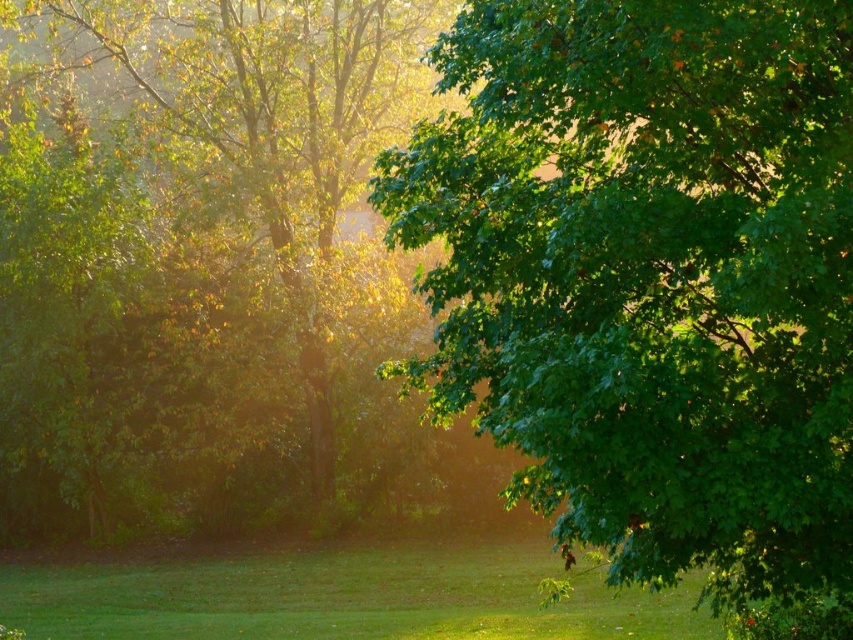
You are standing at the center of the lawn and want to take a photo of the green leafy tree at upper right. Considering your current position, is the tree positioned to your left or right side?

The green leafy tree at upper right is located at point 0.444 on the x axis, which is to the right side of the frame, so from your central position on the lawn, the tree would be to your right side.

You are standing in the middle of the lawn and want to take a photo of the green leafy tree at upper right and the green grass at lower center. Which object should you zoom in more on to capture its details clearly?

The green leafy tree at upper right is smaller in size compared to the green grass at lower center, so you should zoom in more on the green leafy tree at upper right to capture its details clearly.

You are a bird seeking shelter. You notice two trees in the distance, the green leafy tree at upper right and the green leafy tree at left. Which tree would provide more horizontal space for nesting?

The green leafy tree at left has a greater width than the green leafy tree at upper right, so it can provide more horizontal space for nesting.